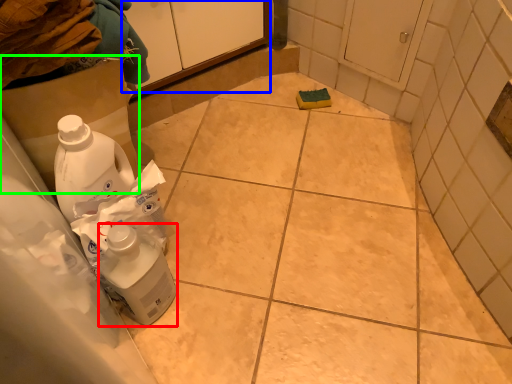
Question: Based on their relative distances, which object is farther from cleaning product (highlighted by a red box)? Choose from cabinetry (highlighted by a blue box) and cardboard box (highlighted by a green box).

Choices:
 (A) cabinetry
 (B) cardboard box

Answer: (A)